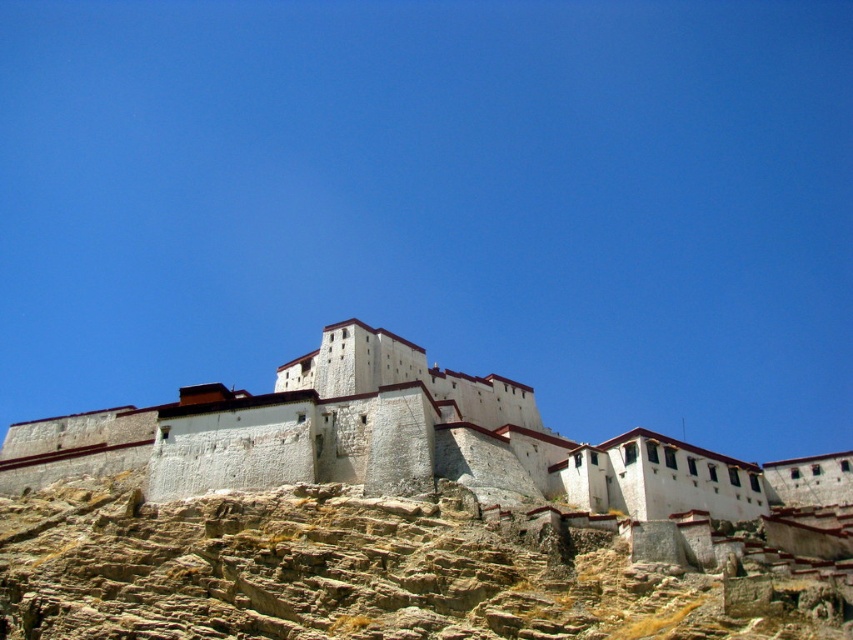
Question: In this image, where is brown rocky hill at lower left located relative to white stone castle at center?

Choices:
 (A) below
 (B) above

Answer: (A)

Question: Does brown rocky hill at lower left appear under white stone castle at center?

Choices:
 (A) yes
 (B) no

Answer: (A)

Question: Does brown rocky hill at lower left come behind white stone castle at center?

Choices:
 (A) no
 (B) yes

Answer: (A)

Question: Among these points, which one is farthest from the camera?

Choices:
 (A) (260, 620)
 (B) (352, 353)

Answer: (B)